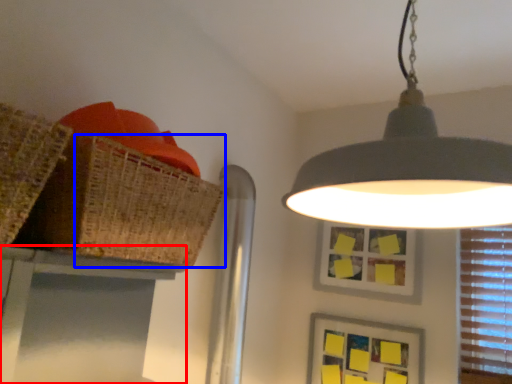
Question: Among these objects, which one is farthest to the camera, table (highlighted by a red box) or basket (highlighted by a blue box)?

Choices:
 (A) table
 (B) basket

Answer: (A)